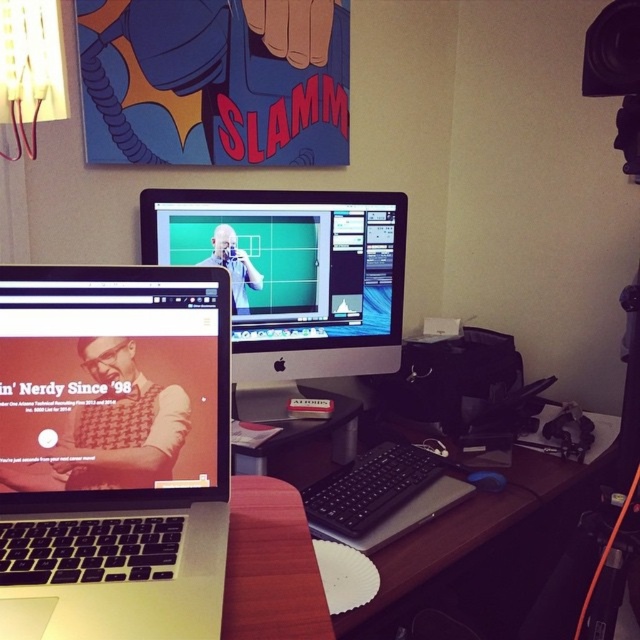
Question: Among these points, which one is farthest from the camera?

Choices:
 (A) (83, 387)
 (B) (225, 198)
 (C) (396, 548)

Answer: (B)

Question: Estimate the real-world distances between objects in this image. Which object is closer to the silver metallic laptop at lower left?

Choices:
 (A) satin black monitor at center
 (B) black plastic computer desk at center

Answer: (B)

Question: Which object appears farthest from the camera in this image?

Choices:
 (A) black plastic computer desk at center
 (B) silver metallic laptop at lower left
 (C) satin black monitor at center

Answer: (C)

Question: Is silver metallic laptop at lower left behind satin black monitor at center?

Choices:
 (A) no
 (B) yes

Answer: (A)

Question: Observing the image, what is the correct spatial positioning of satin black monitor at center in reference to black plastic computer desk at center?

Choices:
 (A) below
 (B) above

Answer: (B)

Question: Does silver metallic laptop at lower left have a larger size compared to black plastic computer desk at center?

Choices:
 (A) no
 (B) yes

Answer: (A)